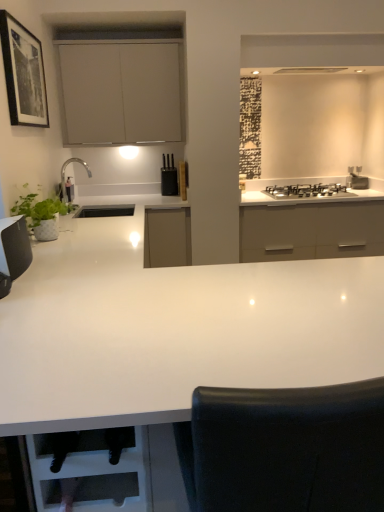
Question: From a real-world perspective, is matte white cabinet at upper center on green matte plant at left?

Choices:
 (A) yes
 (B) no

Answer: (A)

Question: Does matte white cabinet at upper center have a lesser height compared to green matte plant at left?

Choices:
 (A) no
 (B) yes

Answer: (A)

Question: Is matte white cabinet at upper center positioned far away from green matte plant at left?

Choices:
 (A) no
 (B) yes

Answer: (B)

Question: From a real-world perspective, is matte white cabinet at upper center under green matte plant at left?

Choices:
 (A) no
 (B) yes

Answer: (A)

Question: Does matte white cabinet at upper center touch green matte plant at left?

Choices:
 (A) yes
 (B) no

Answer: (B)

Question: Visually, is green matte plant at left positioned to the left or to the right of black matte picture frame at upper left?

Choices:
 (A) left
 (B) right

Answer: (B)

Question: In terms of size, does green matte plant at left appear bigger or smaller than black matte picture frame at upper left?

Choices:
 (A) small
 (B) big

Answer: (A)

Question: Considering the positions of green matte plant at left and black matte picture frame at upper left in the image, is green matte plant at left wider or thinner than black matte picture frame at upper left?

Choices:
 (A) wide
 (B) thin

Answer: (A)

Question: From the image's perspective, is green matte plant at left above or below black matte picture frame at upper left?

Choices:
 (A) below
 (B) above

Answer: (A)

Question: Is satin silver stove at upper right wider or thinner than green matte plant at left?

Choices:
 (A) wide
 (B) thin

Answer: (B)

Question: Would you say satin silver stove at upper right is inside or outside green matte plant at left?

Choices:
 (A) inside
 (B) outside

Answer: (B)

Question: In the image, is satin silver stove at upper right positioned in front of or behind green matte plant at left?

Choices:
 (A) behind
 (B) front

Answer: (A)

Question: Based on their sizes in the image, would you say satin silver stove at upper right is bigger or smaller than green matte plant at left?

Choices:
 (A) small
 (B) big

Answer: (A)

Question: From their relative heights in the image, would you say matte white cabinet at upper center is taller or shorter than satin silver stove at upper right?

Choices:
 (A) tall
 (B) short

Answer: (A)

Question: From a real-world perspective, is matte white cabinet at upper center physically located above or below satin silver stove at upper right?

Choices:
 (A) below
 (B) above

Answer: (B)